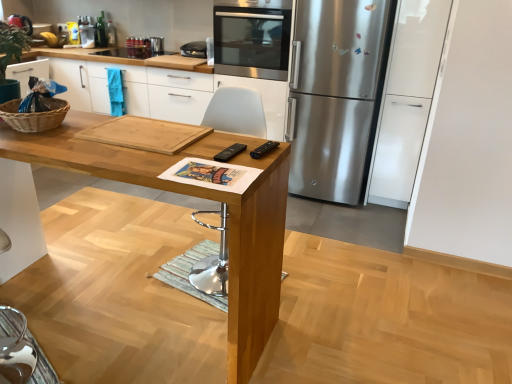
Locate an element on the screen. The image size is (512, 384). vacant space to the right of natural wood table at center is located at coordinates (342, 302).